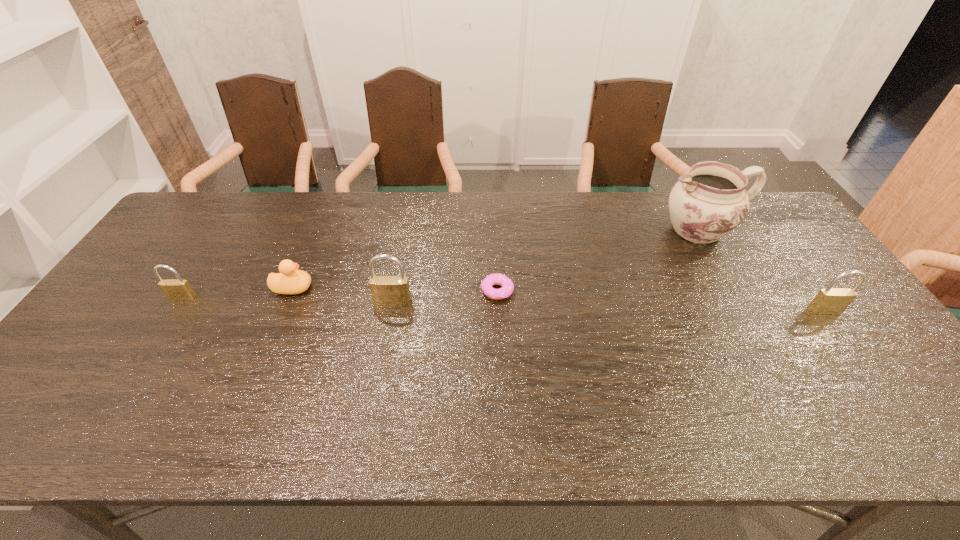
Point out which padlock is positioned as the nearest to the fourth shortest object. Please provide its 2D coordinates. Your answer should be formatted as a tuple, i.e. [(x, y)], where the tuple contains the x and y coordinates of a point satisfying the conditions above.

[(385, 290)]

Identify the location of padlock that is the closest to the fourth object from right to left. (174, 289).

This screenshot has width=960, height=540. What are the coordinates of `blank area in the image that satisfies the following two spatial constraints: 1. on the face of the shortest object; 2. on the right side of the second object from left to right` in the screenshot? It's located at (291, 291).